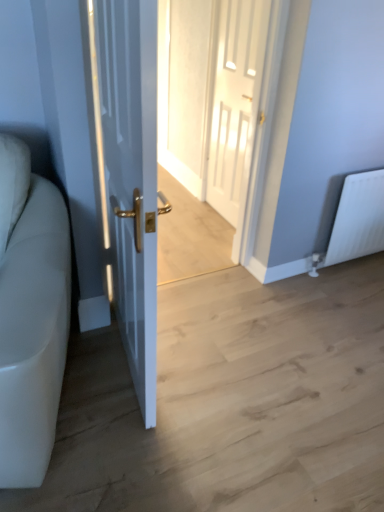
Question: Which direction should I rotate to look at white glossy door at center, arranged as the second door when viewed from the left?

Choices:
 (A) right
 (B) left

Answer: (A)

Question: Is white leather couch at left next to white glossy door at center, arranged as the second door when viewed from the left?

Choices:
 (A) no
 (B) yes

Answer: (A)

Question: From a real-world perspective, is white leather couch at left located beneath white glossy door at center, the 2th door when ordered from front to back?

Choices:
 (A) no
 (B) yes

Answer: (B)

Question: Does white leather couch at left have a greater width compared to white glossy door at center, the first door viewed from the right?

Choices:
 (A) yes
 (B) no

Answer: (A)

Question: Can we say white leather couch at left lies outside white glossy door at center, which is the first door in back-to-front order?

Choices:
 (A) yes
 (B) no

Answer: (A)

Question: Would you say white leather couch at left contains white glossy door at center, arranged as the second door when viewed from the left?

Choices:
 (A) yes
 (B) no

Answer: (B)

Question: Is the depth of white leather couch at left less than that of white glossy door at center, arranged as the second door when viewed from the left?

Choices:
 (A) no
 (B) yes

Answer: (B)

Question: Is white glossy door at center wider than white glossy door at left, the first door positioned from the front?

Choices:
 (A) no
 (B) yes

Answer: (A)

Question: Does white glossy door at center have a larger size compared to white glossy door at left, positioned as the first door in left-to-right order?

Choices:
 (A) no
 (B) yes

Answer: (A)

Question: From a real-world perspective, is white glossy door at center below white glossy door at left, positioned as the first door in left-to-right order?

Choices:
 (A) no
 (B) yes

Answer: (B)

Question: Is white glossy door at center positioned with its back to white glossy door at left, the first door positioned from the front?

Choices:
 (A) no
 (B) yes

Answer: (A)

Question: Does white glossy door at center have a lesser height compared to white glossy door at left, positioned as the first door in left-to-right order?

Choices:
 (A) yes
 (B) no

Answer: (A)

Question: Does white glossy door at center have a lesser width compared to white glossy door at left, the 2th door in the back-to-front sequence?

Choices:
 (A) yes
 (B) no

Answer: (A)

Question: From a real-world perspective, is white glossy door at center, arranged as the second door when viewed from the left, positioned under white glossy door at left, which is the second door from right to left, based on gravity?

Choices:
 (A) no
 (B) yes

Answer: (B)